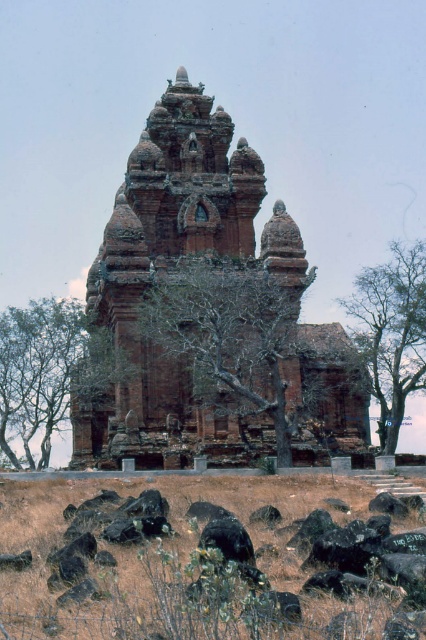
You are an archaeologist examining the ancient stone structure. You notice two trees at the center. Which one is closer to you, the bare branches at center or the green leafy tree at center?

The bare branches at center is in front of the green leafy tree at center, so it is closer to you.

You are an archaeologist examining the ancient stone structure. You notice the brown rock pile at center and the bare wood tree at center. Which object is positioned lower in the scene?

The brown rock pile at center is below the bare wood tree at center, so the brown rock pile at center is positioned lower in the scene.